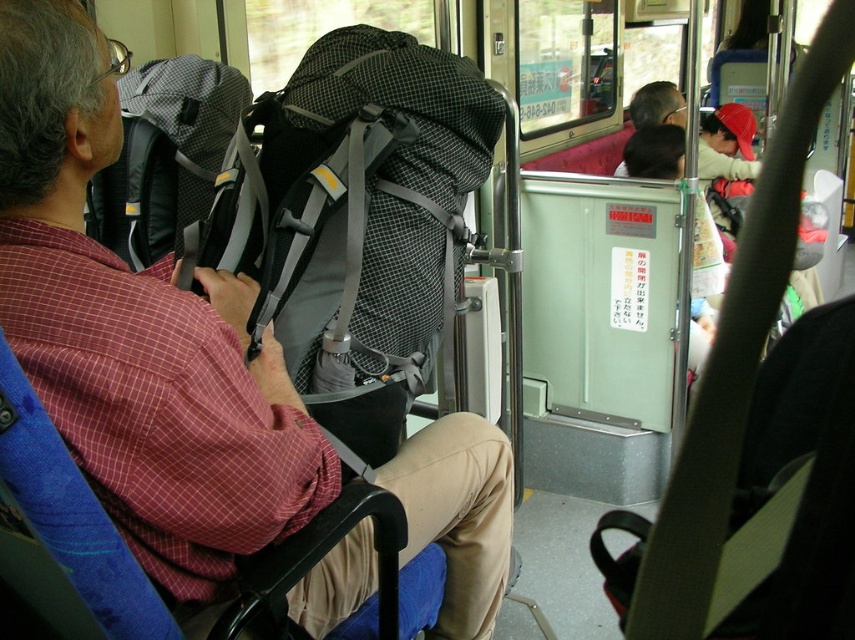
Question: Is matte black backpack at center positioned at the back of gray mesh backpack at left?

Choices:
 (A) yes
 (B) no

Answer: (B)

Question: Does matte black backpack at center come behind gray mesh backpack at left?

Choices:
 (A) yes
 (B) no

Answer: (B)

Question: Does matte black backpack at center come behind gray mesh backpack at left?

Choices:
 (A) no
 (B) yes

Answer: (A)

Question: Which object appears farthest from the camera in this image?

Choices:
 (A) gray mesh backpack at left
 (B) matte black backpack at center

Answer: (A)